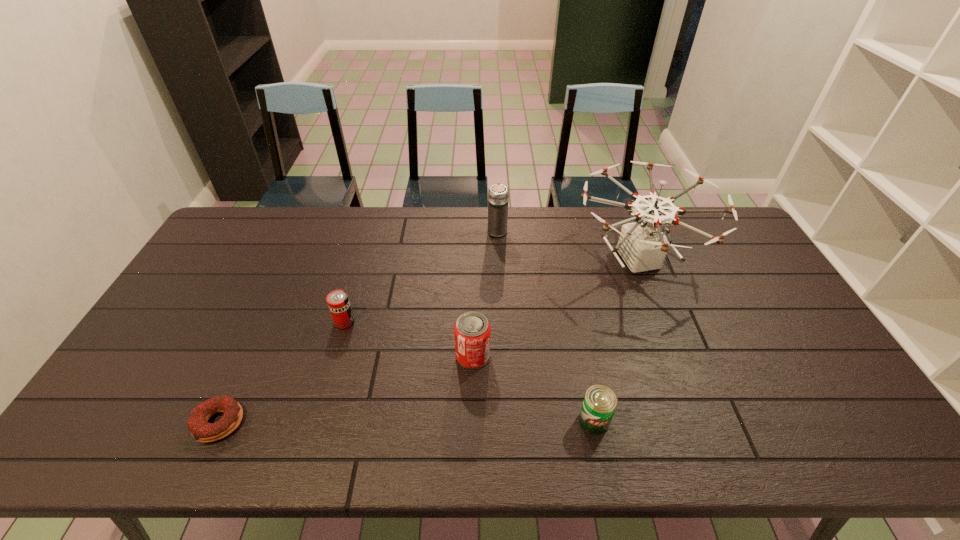
The height and width of the screenshot is (540, 960). What are the coordinates of `free space at the near edge of the desktop` in the screenshot? It's located at (800, 447).

You are a GUI agent. You are given a task and a screenshot of the screen. Output one action in this format:
    pyautogui.click(x=<x>, y=<y>)
    Task: Click on the vacant space at the right edge
    
    Given the screenshot: What is the action you would take?
    pyautogui.click(x=764, y=341)

This screenshot has width=960, height=540. I want to click on vacant area at the far left corner, so click(x=265, y=209).

Where is `vacant position at the far right corner of the desktop`? This screenshot has height=540, width=960. vacant position at the far right corner of the desktop is located at coordinates (x=720, y=233).

The height and width of the screenshot is (540, 960). What are the coordinates of `vacant space at the near right corner of the desktop` in the screenshot? It's located at (857, 444).

At what (x,y) coordinates should I click in order to perform the action: click on free space between the third tallest object and the fourth nearest object. Please return your answer as a coordinate pair (x, y). The image size is (960, 540). Looking at the image, I should click on (409, 339).

Locate an element on the screen. vacant area between the second farthest can and the drone is located at coordinates (556, 308).

You are a GUI agent. You are given a task and a screenshot of the screen. Output one action in this format:
    pyautogui.click(x=<x>, y=<y>)
    Task: Click on the empty space that is in between the doughnut and the tallest can
    The height and width of the screenshot is (540, 960).
    Given the screenshot: What is the action you would take?
    [346, 389]

What are the coordinates of `vacant area that lies between the tallest object and the shortest object` in the screenshot? It's located at (428, 341).

Image resolution: width=960 pixels, height=540 pixels. I want to click on free space between the fifth shortest object and the shortest object, so pyautogui.click(x=358, y=327).